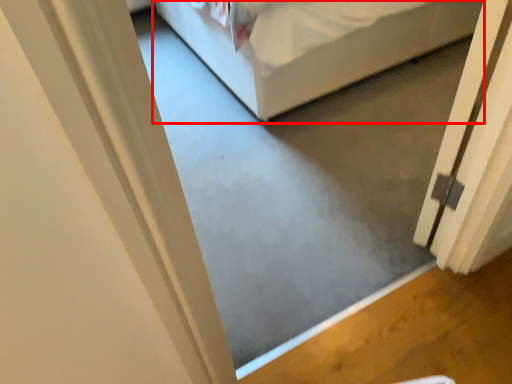
Question: Observing the image, what is the correct spatial positioning of bed (annotated by the red box) in reference to door?

Choices:
 (A) left
 (B) right

Answer: (A)